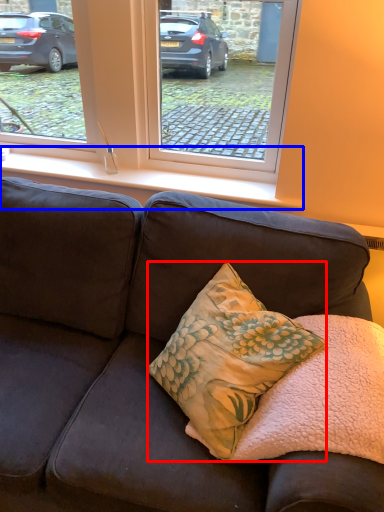
Question: Which object is further to the camera taking this photo, pillow (highlighted by a red box) or window sill (highlighted by a blue box)?

Choices:
 (A) pillow
 (B) window sill

Answer: (B)